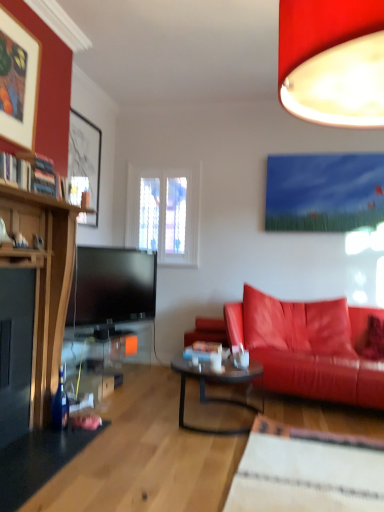
Question: In the image, is matte red lampshade at upper right positioned in front of or behind translucent glass coffee table at center?

Choices:
 (A) behind
 (B) front

Answer: (B)

Question: In terms of height, does matte red lampshade at upper right look taller or shorter compared to translucent glass coffee table at center?

Choices:
 (A) tall
 (B) short

Answer: (A)

Question: Which of these objects is positioned farthest from the shiny leather couch at right?

Choices:
 (A) matte black picture frame at upper left, which is counted as the first picture frame, starting from the back
 (B) wooden picture frame at upper left, the 1th picture frame when ordered from front to back
 (C) matte red lampshade at upper right
 (D) hardcover books at upper left
 (E) translucent glass coffee table at center

Answer: (B)

Question: Estimate the real-world distances between objects in this image. Which object is closer to the translucent glass coffee table at center?

Choices:
 (A) matte red lampshade at upper right
 (B) matte black picture frame at upper left, marked as the second picture frame in a front-to-back arrangement
 (C) hardcover books at upper left
 (D) shiny leather couch at right
 (E) wooden picture frame at upper left, the 1th picture frame when ordered from front to back

Answer: (D)